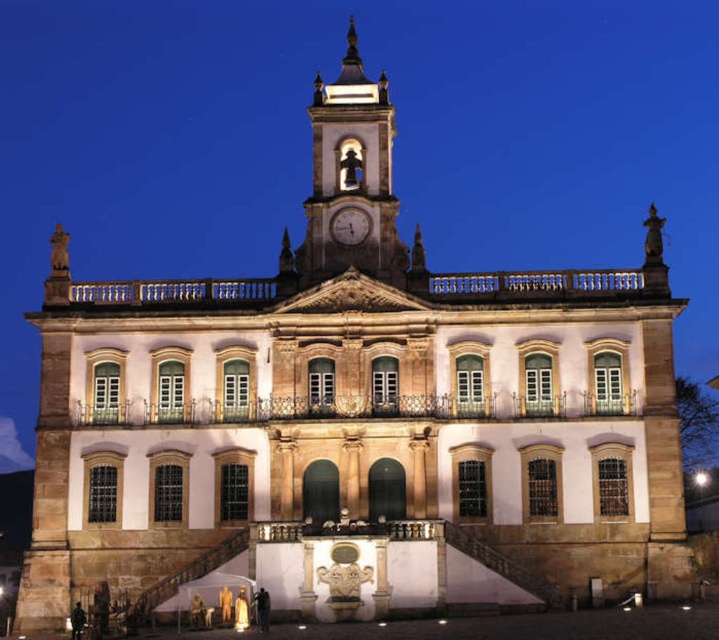
Who is shorter, polished stone clock tower at center or metallic clock at center?

With less height is metallic clock at center.

Looking at this image, is polished stone clock tower at center to the right of metallic clock at center from the viewer's perspective?

Incorrect, polished stone clock tower at center is not on the right side of metallic clock at center.

Which is in front, point (344, 260) or point (362, 227)?

Point (344, 260)

Find the location of a particular element. This screenshot has height=640, width=719. polished stone clock tower at center is located at coordinates (352, 179).